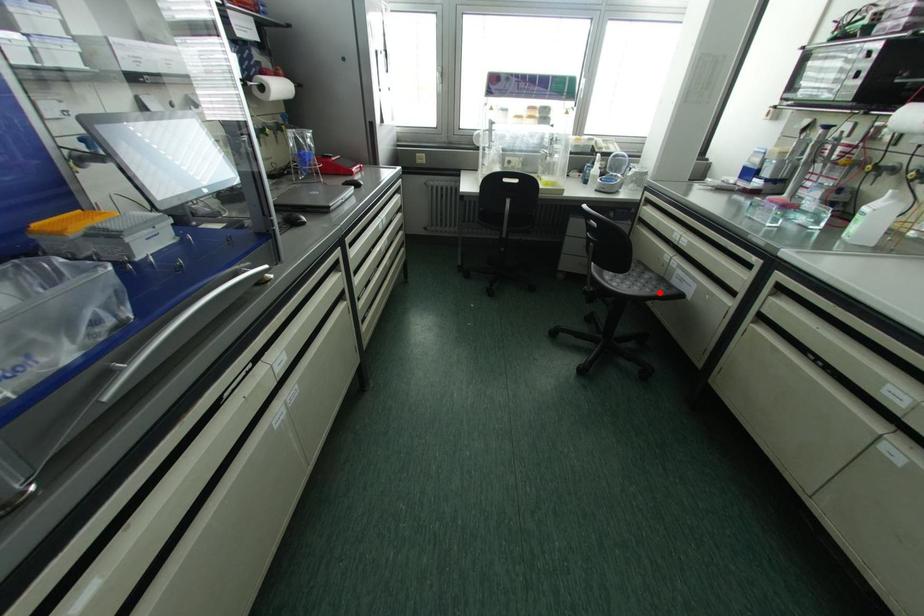
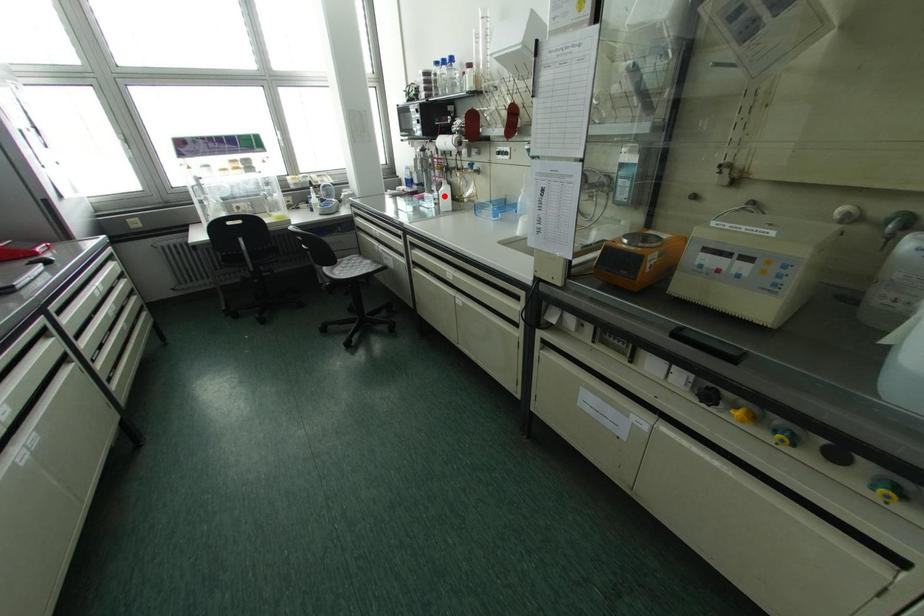
I am providing you with two images of the same scene from different viewpoints. A red point is marked on the first image and another point is marked on the second image. Is the marked point in image1 the same physical position as the marked point in image2?

No